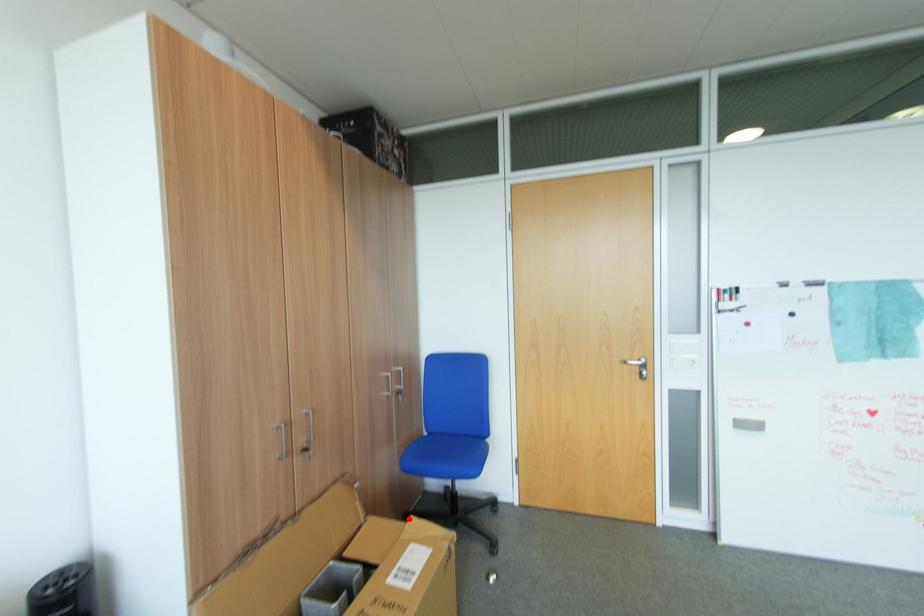
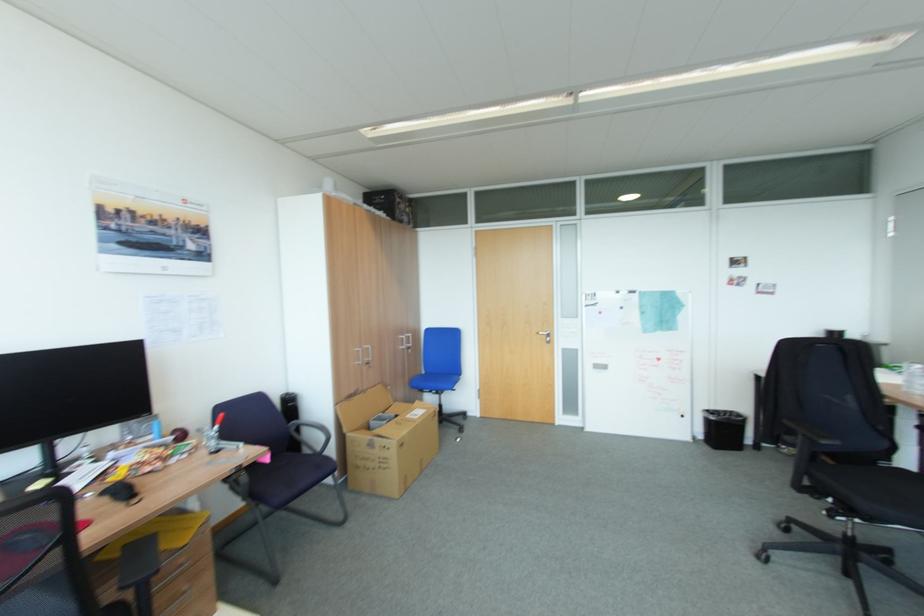
The point at the highlighted location is marked in the first image. Where is the corresponding point in the second image?

(419, 403)